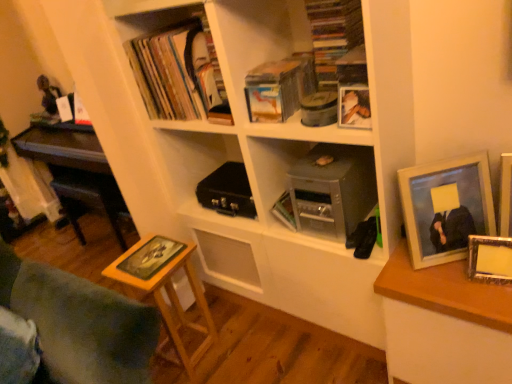
What are the coordinates of `vacant area situated below yellow matte board game at lower left, placed as the first book when sorted from left to right (from a real-world perspective)` in the screenshot? It's located at pos(150,253).